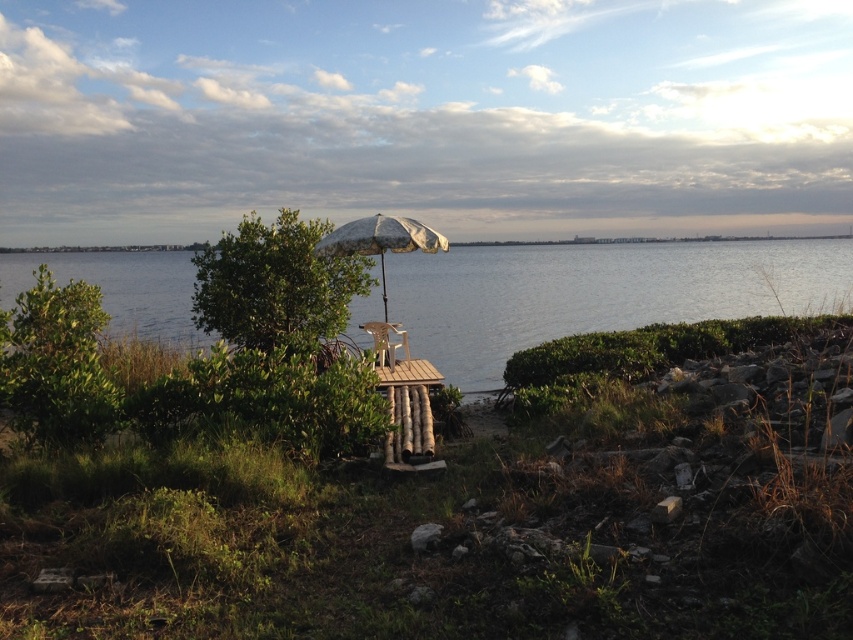
In the scene shown: Which is more to the left, clear water at center or printed fabric umbrella at center?

clear water at center is more to the left.

You are a GUI agent. You are given a task and a screenshot of the screen. Output one action in this format:
    pyautogui.click(x=<x>, y=<y>)
    Task: Click on the clear water at center
    Image resolution: width=853 pixels, height=640 pixels.
    Given the screenshot: What is the action you would take?
    pyautogui.click(x=598, y=292)

Does green leafy bush at left have a larger size compared to metallic silver beach chair at center?

Correct, green leafy bush at left is larger in size than metallic silver beach chair at center.

What do you see at coordinates (57, 364) in the screenshot? I see `green leafy bush at left` at bounding box center [57, 364].

Locate an element on the screen. The height and width of the screenshot is (640, 853). green leafy bush at left is located at coordinates (57, 364).

Which is behind, point (65, 387) or point (367, 253)?

The point (367, 253) is behind.

Who is positioned more to the left, green leafy bush at left or printed fabric umbrella at center?

From the viewer's perspective, green leafy bush at left appears more on the left side.

Locate an element on the screen. This screenshot has width=853, height=640. green leafy bush at left is located at coordinates click(x=57, y=364).